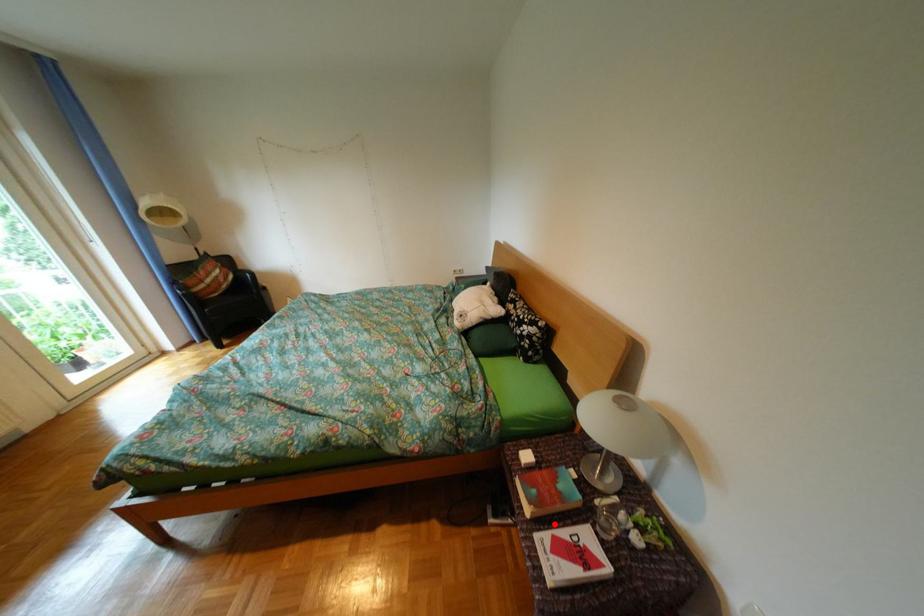
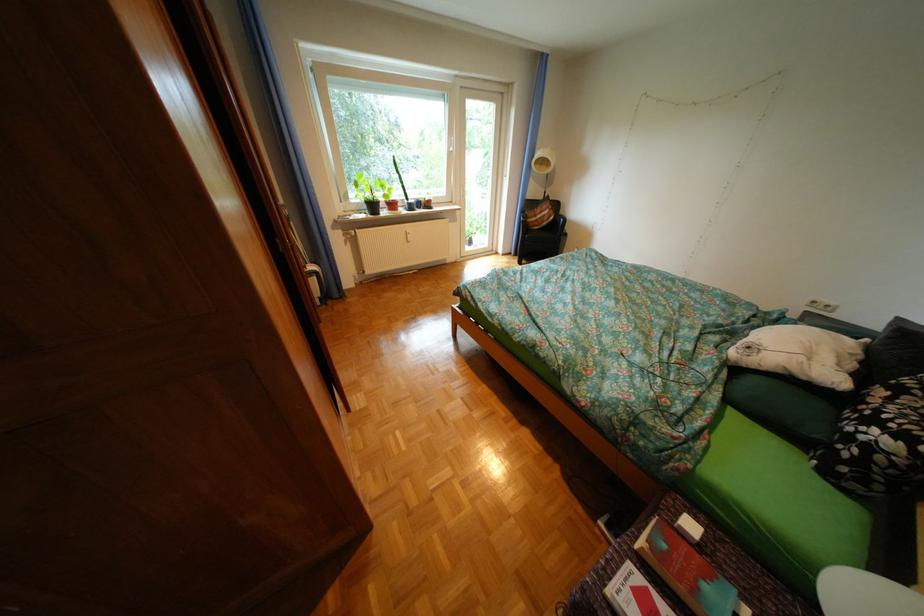
The point at the highlighted location is marked in the first image. Where is the corresponding point in the second image?

(658, 565)